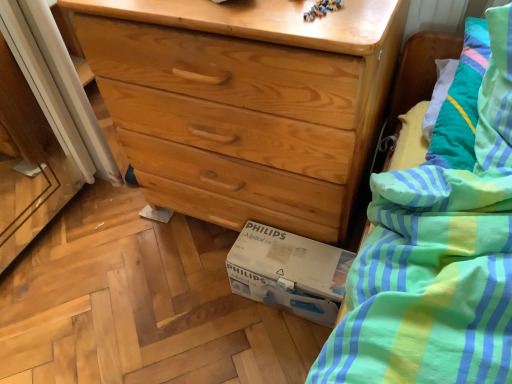
Find the location of `free point above white cardboard box at lower center (from a real-world perspective)`. free point above white cardboard box at lower center (from a real-world perspective) is located at coordinates (285, 255).